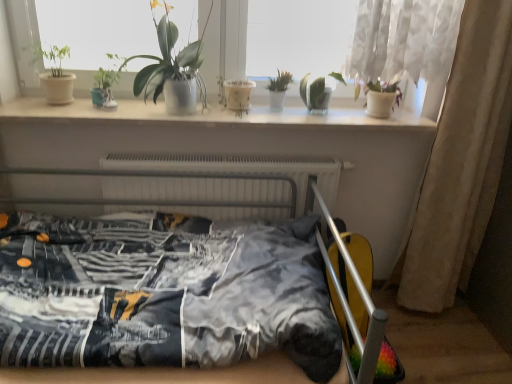
This screenshot has height=384, width=512. I want to click on vacant space that's between green glossy plant at upper center, the 3th houseplant from the left, and matte white flowerpot at center, so click(x=226, y=113).